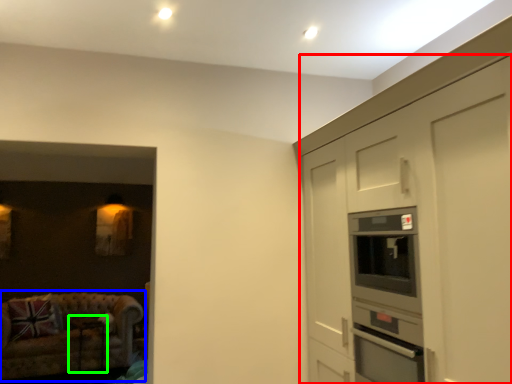
Question: Which object is positioned closest to cabinetry (highlighted by a red box)? Select from studio couch (highlighted by a blue box) and table (highlighted by a green box).

Choices:
 (A) studio couch
 (B) table

Answer: (A)